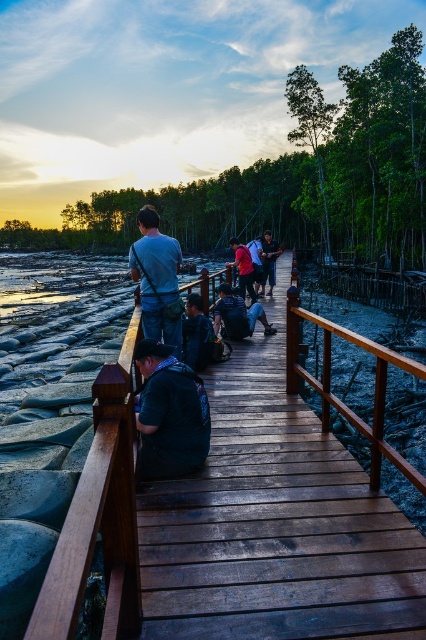
Which is in front, point (141, 472) or point (270, 291)?

Point (141, 472)

Between dark blue fabric shirt at center and matte black backpack at center, which one is positioned lower?

Positioned lower is dark blue fabric shirt at center.

The image size is (426, 640). What do you see at coordinates (169, 413) in the screenshot?
I see `dark blue fabric shirt at center` at bounding box center [169, 413].

Identify the location of dark blue fabric shirt at center. (169, 413).

Which of these two, matte blue shirt at center or matte red shirt at center, stands shorter?

With less height is matte blue shirt at center.

Who is more forward, [155,282] or [226,266]?

Point [155,282] is more forward.

The height and width of the screenshot is (640, 426). I want to click on matte blue shirt at center, so click(157, 280).

Can you confirm if brown wooden bridge at center is wider than matte black backpack at center?

Incorrect, brown wooden bridge at center's width does not surpass matte black backpack at center's.

Can you confirm if brown wooden bridge at center is positioned above matte black backpack at center?

Incorrect, brown wooden bridge at center is not positioned above matte black backpack at center.

Locate an element on the screen. This screenshot has width=426, height=640. brown wooden bridge at center is located at coordinates (236, 524).

The image size is (426, 640). In order to click on brown wooden bridge at center in this screenshot , I will do `click(236, 524)`.